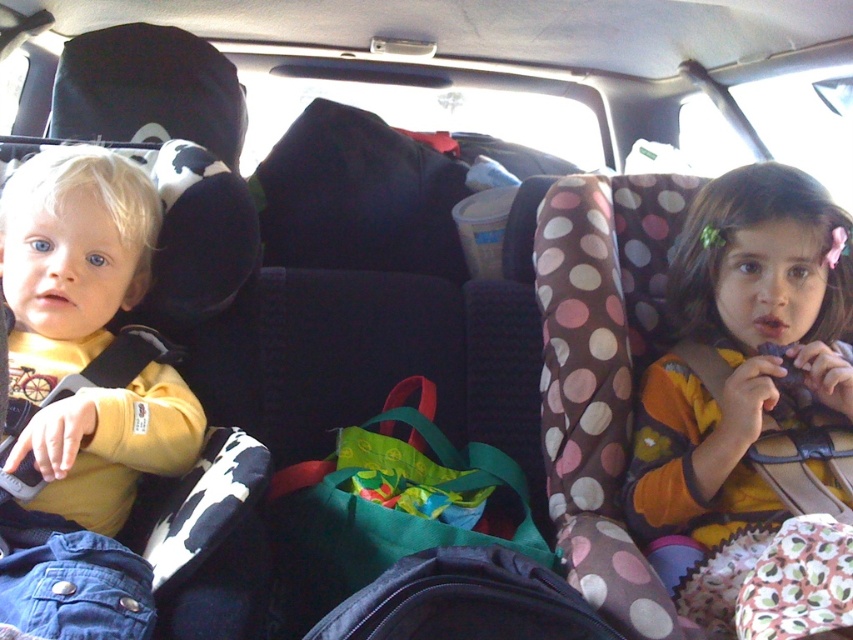
You are a parent trying to place a small toy between the matte yellow shirt at left and the polka dot fabric car seat at right in the back seat. Based on their sizes, which object should you position the toy closer to?

The matte yellow shirt at left has a lesser width compared to the polka dot fabric car seat at right, so you should position the toy closer to the matte yellow shirt at left to ensure there is enough space.

You are a parent trying to hand a snack to your child in the polka dot fabric car seat at right. The other child in the matte yellow shirt at left is also reaching for it. Based on their positions, which child is closer to your hand when you extend it from the front seat?

The matte yellow shirt at left is positioned on the left side of the polka dot fabric car seat at right, so the child in the matte yellow shirt at left is closer to your hand.

You are a parent in the front seat checking the backseat through the rearview mirror. You notice the matte yellow shirt at left and the polka dot fabric car seat at right. Which object appears larger in your view?

The polka dot fabric car seat at right appears larger because the matte yellow shirt at left is smaller than the polka dot fabric car seat at right.